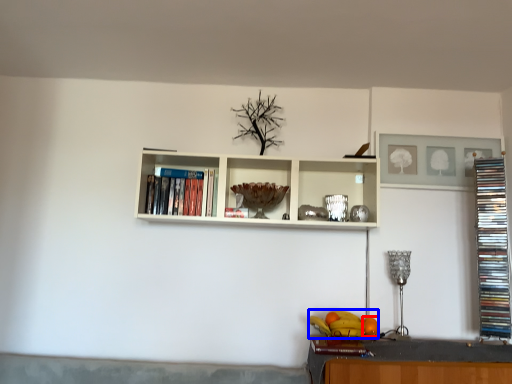
Question: Which object appears closest to the camera in this image, orange (highlighted by a red box) or fruit (highlighted by a blue box)?

Choices:
 (A) orange
 (B) fruit

Answer: (B)